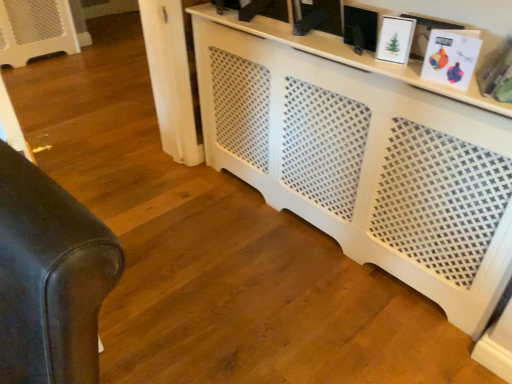
This screenshot has width=512, height=384. What are the coordinates of `vacant area to the right of leather couch at left` in the screenshot? It's located at (186, 281).